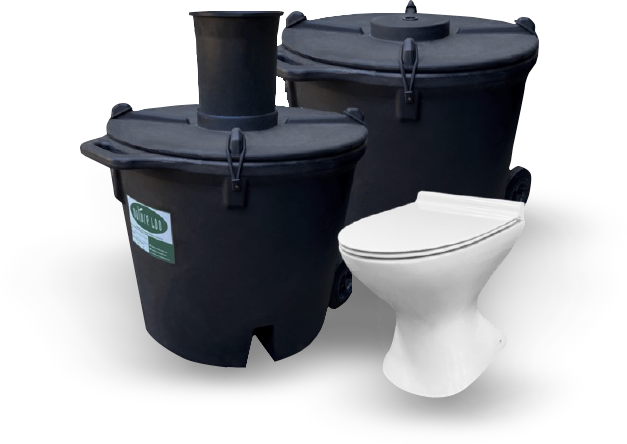
In order to click on toilet in this screenshot , I will do `click(446, 286)`.